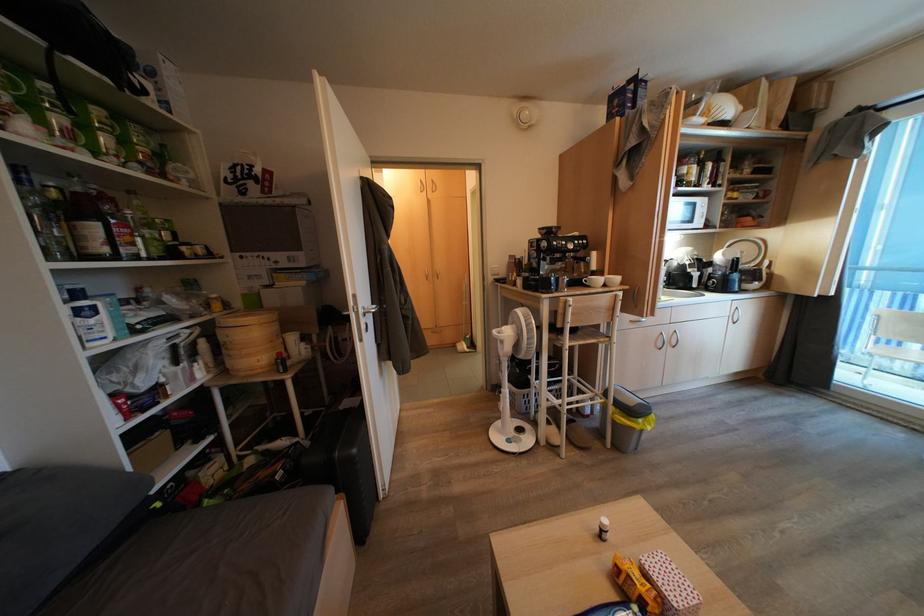
Where is `espresso machine lever`? espresso machine lever is located at coordinates (554, 261).